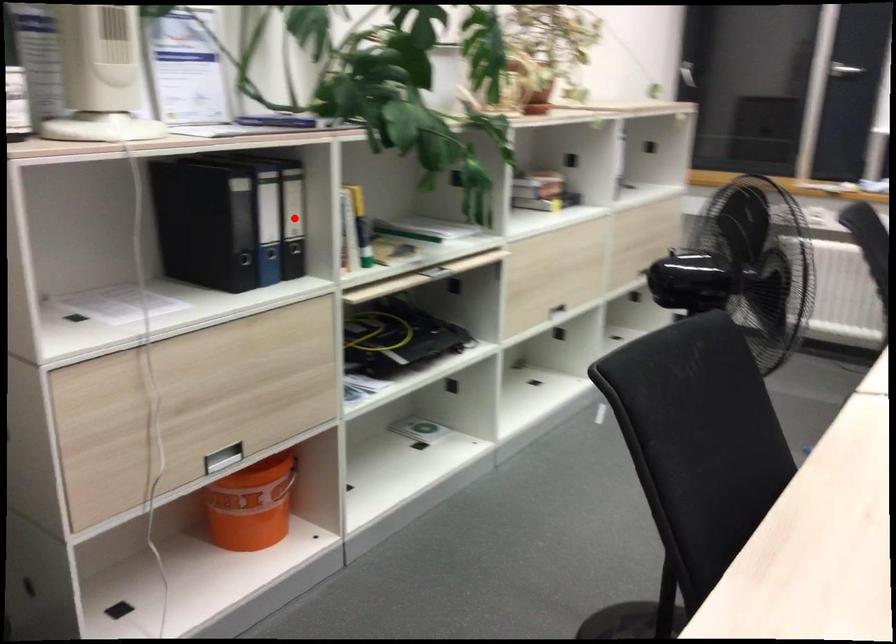
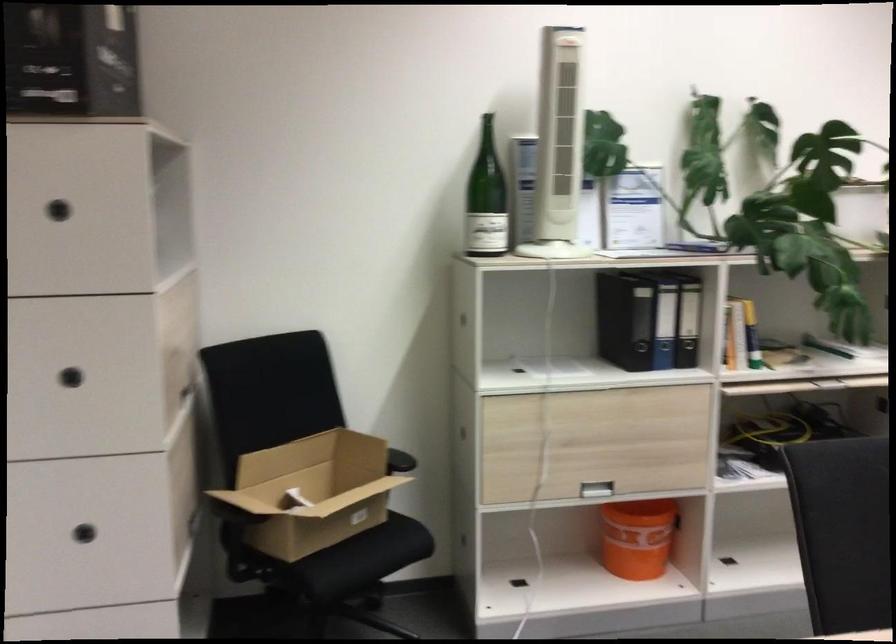
Question: I am providing you with two images of the same scene from different viewpoints. A red point is marked on the first image. Can you still see the location of the red point in image 2?

Choices:
 (A) Yes
 (B) No

Answer: (A)